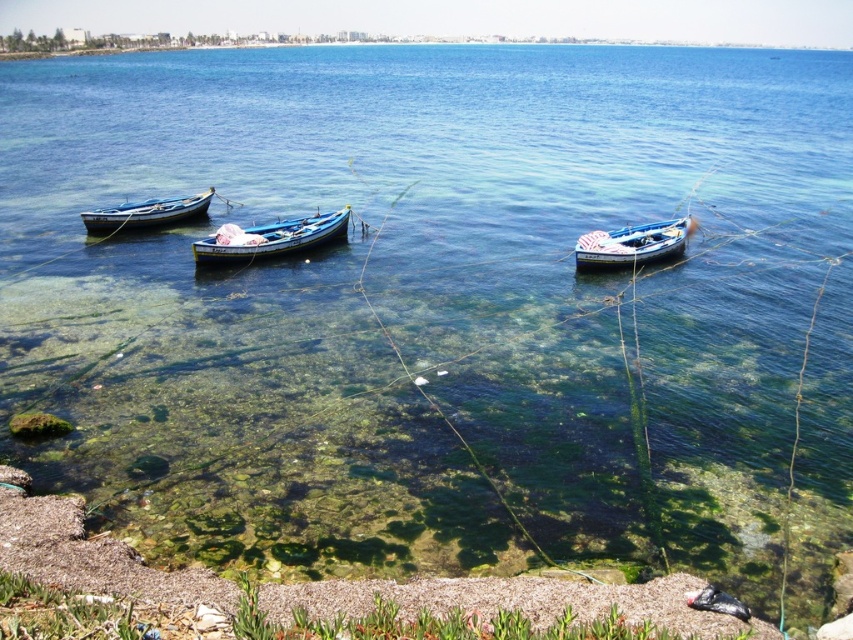
Can you confirm if wooden blue boat at center is positioned below blue wooden boat at center?

Incorrect, wooden blue boat at center is not positioned below blue wooden boat at center.

Does point (253, 241) come closer to viewer compared to point (671, 256)?

Yes, point (253, 241) is in front of point (671, 256).

Locate an element on the screen. The height and width of the screenshot is (640, 853). wooden blue boat at center is located at coordinates (273, 237).

Measure the distance between wooden blue boat at center and camera.

They are 81.76 feet apart.

Is wooden blue boat at center above wooden boat at left?

Incorrect, wooden blue boat at center is not positioned above wooden boat at left.

Is point (281, 237) less distant than point (202, 195)?

Yes, point (281, 237) is in front of point (202, 195).

Image resolution: width=853 pixels, height=640 pixels. What are the coordinates of `wooden blue boat at center` in the screenshot? It's located at (273, 237).

Between blue wooden boat at center and wooden boat at left, which one appears on the right side from the viewer's perspective?

From the viewer's perspective, blue wooden boat at center appears more on the right side.

Who is taller, blue wooden boat at center or wooden boat at left?

Standing taller between the two is wooden boat at left.

Is point (611, 244) farther from viewer compared to point (134, 227)?

No, (611, 244) is in front of (134, 227).

Identify the location of blue wooden boat at center. This screenshot has height=640, width=853. (631, 244).